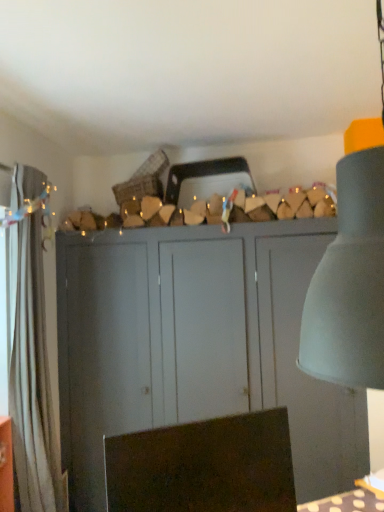
What do you see at coordinates (204, 466) in the screenshot?
I see `brown fabric swivel chair at lower center` at bounding box center [204, 466].

Where is `brown fabric swivel chair at lower center`? The image size is (384, 512). brown fabric swivel chair at lower center is located at coordinates (204, 466).

From a real-world perspective, between matte gray cupboard at center and white fabric curtain at left, who is vertically lower?

matte gray cupboard at center, from a real-world perspective.

Find the location of `curtain above the matte gray cupboard at center (from the image's perspective)`. curtain above the matte gray cupboard at center (from the image's perspective) is located at coordinates (30, 349).

Can you tell me how much matte gray cupboard at center and white fabric curtain at left differ in facing direction?

There is a 89.5-degree angle between the facing directions of matte gray cupboard at center and white fabric curtain at left.

From the image's perspective, which one is positioned higher, matte gray cupboard at center or white fabric curtain at left?

white fabric curtain at left is shown above in the image.

Does white fabric curtain at left have a lesser height compared to brown fabric swivel chair at lower center?

Incorrect, the height of white fabric curtain at left does not fall short of that of brown fabric swivel chair at lower center.

Who is smaller, white fabric curtain at left or brown fabric swivel chair at lower center?

brown fabric swivel chair at lower center.

Can you confirm if white fabric curtain at left is thinner than brown fabric swivel chair at lower center?

In fact, white fabric curtain at left might be wider than brown fabric swivel chair at lower center.

From the image's perspective, relative to matte gray cupboard at center, is brown fabric swivel chair at lower center above or below?

Clearly, from the image's perspective, brown fabric swivel chair at lower center is above matte gray cupboard at center.

Looking at the image, does brown fabric swivel chair at lower center seem bigger or smaller compared to matte gray cupboard at center?

Considering their sizes, brown fabric swivel chair at lower center takes up less space than matte gray cupboard at center.

Considering the relative sizes of brown fabric swivel chair at lower center and matte gray cupboard at center in the image provided, is brown fabric swivel chair at lower center thinner than matte gray cupboard at center?

Yes, brown fabric swivel chair at lower center is thinner than matte gray cupboard at center.

Between brown fabric swivel chair at lower center and matte gray cupboard at center, which one is positioned behind?

Answer: matte gray cupboard at center is further away from the camera.

In the scene shown: Between white fabric curtain at left and matte gray cupboard at center, which one appears on the left side from the viewer's perspective?

Positioned to the left is white fabric curtain at left.

Identify the location of curtain above the matte gray cupboard at center (from a real-world perspective). (30, 349).

From the image's perspective, is white fabric curtain at left positioned above or below matte gray cupboard at center?

white fabric curtain at left is situated higher than matte gray cupboard at center in the image.

Is white fabric curtain at left beside matte gray cupboard at center?

There is a gap between white fabric curtain at left and matte gray cupboard at center.

From the image's perspective, is matte gray cupboard at center on brown fabric swivel chair at lower center?

No, from the image's perspective, matte gray cupboard at center is not on top of brown fabric swivel chair at lower center.

Who is smaller, matte gray cupboard at center or brown fabric swivel chair at lower center?

With smaller size is brown fabric swivel chair at lower center.

Based on their positions, is matte gray cupboard at center located to the left or right of brown fabric swivel chair at lower center?

From the image, it's evident that matte gray cupboard at center is to the right of brown fabric swivel chair at lower center.

How different are the orientations of matte gray cupboard at center and brown fabric swivel chair at lower center in degrees?

28.2 degrees separate the facing orientations of matte gray cupboard at center and brown fabric swivel chair at lower center.

Is brown fabric swivel chair at lower center bigger than white fabric curtain at left?

Actually, brown fabric swivel chair at lower center might be smaller than white fabric curtain at left.

From the image's perspective, between brown fabric swivel chair at lower center and white fabric curtain at left, who is located below?

brown fabric swivel chair at lower center appears lower in the image.

Is brown fabric swivel chair at lower center far away from white fabric curtain at left?

Yes.

Is brown fabric swivel chair at lower center oriented away from white fabric curtain at left?

Yes, brown fabric swivel chair at lower center is positioned with its back facing white fabric curtain at left.

At what (x,y) coordinates should I click in order to perform the action: click on cupboard below the white fabric curtain at left (from the image's perspective). Please return your answer as a coordinate pair (x, y). Looking at the image, I should click on (196, 345).

Identify the location of curtain lying above the brown fabric swivel chair at lower center (from the image's perspective). The height and width of the screenshot is (512, 384). (30, 349).

Based on their spatial positions, is matte gray cupboard at center or white fabric curtain at left further from brown fabric swivel chair at lower center?

matte gray cupboard at center.

Considering their positions, is brown fabric swivel chair at lower center positioned further to matte gray cupboard at center than white fabric curtain at left?

brown fabric swivel chair at lower center is further to matte gray cupboard at center.

From the picture: Considering their positions, is white fabric curtain at left positioned further to matte gray cupboard at center than brown fabric swivel chair at lower center?

brown fabric swivel chair at lower center is further to matte gray cupboard at center.

Based on their spatial positions, is white fabric curtain at left or matte gray cupboard at center closer to brown fabric swivel chair at lower center?

white fabric curtain at left is positioned closer to the anchor brown fabric swivel chair at lower center.

Considering their positions, is matte gray cupboard at center positioned closer to white fabric curtain at left than brown fabric swivel chair at lower center?

Among the two, matte gray cupboard at center is located nearer to white fabric curtain at left.

Consider the image. Which object lies nearer to the anchor point white fabric curtain at left, brown fabric swivel chair at lower center or matte gray cupboard at center?

matte gray cupboard at center lies closer to white fabric curtain at left than the other object.

Locate an element on the screen. This screenshot has height=512, width=384. curtain between brown fabric swivel chair at lower center and matte gray cupboard at center along the z-axis is located at coordinates (30, 349).